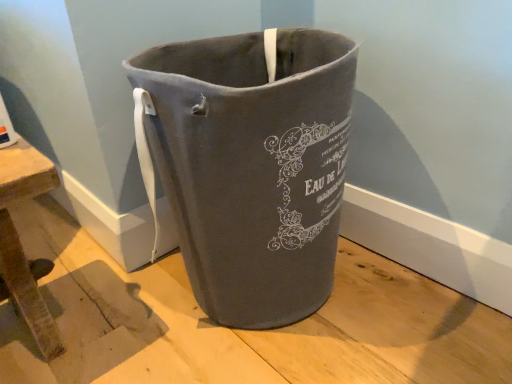
What is the approximate height of matte gray fabric bucket at center?

matte gray fabric bucket at center is 20.21 inches tall.

Locate an element on the screen. matte gray fabric bucket at center is located at coordinates (252, 166).

Image resolution: width=512 pixels, height=384 pixels. What do you see at coordinates (252, 166) in the screenshot?
I see `matte gray fabric bucket at center` at bounding box center [252, 166].

At what (x,y) coordinates should I click in order to perform the action: click on matte gray fabric bucket at center. Please return your answer as a coordinate pair (x, y). The image size is (512, 384). Looking at the image, I should click on (252, 166).